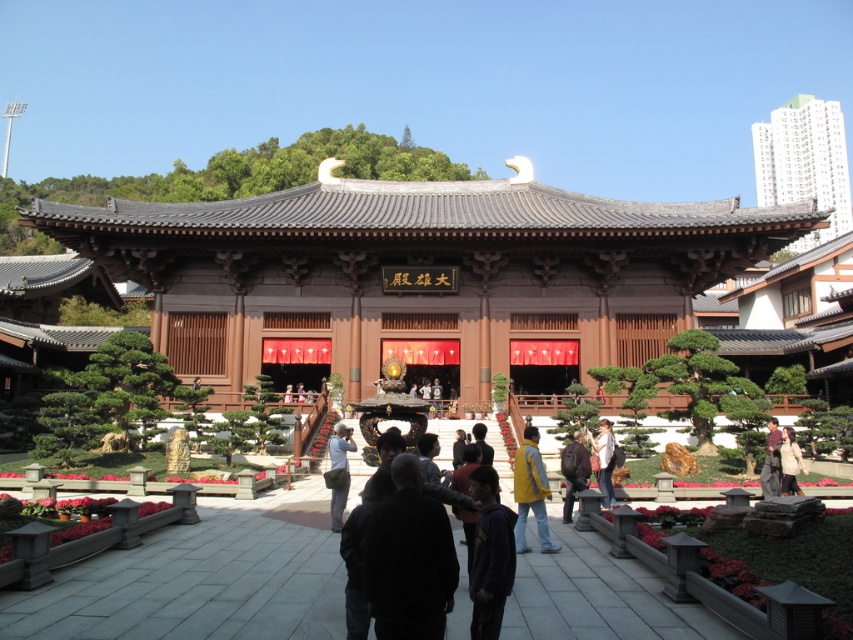
Consider the image. You are a tourist visiting this East Asian temple. You see the white concrete building at upper right and the yellow fabric jacket at center. Which object is bigger in size?

The white concrete building at upper right is larger in size than the yellow fabric jacket at center.

You are a visitor at this temple and see both the brown leather jacket at center and the denim jacket at lower center placed in the courtyard. If you want to pick up the jacket that is closer to the ground, which one should you choose?

The denim jacket at lower center is closer to the ground, so you should choose the denim jacket at lower center.

You are a visitor to this temple and have brought two jackets with you. You need to place them on the stone tiles in the courtyard. The brown leather jacket at center is wider than the denim jacket at lower center. Which jacket should you choose if you want to place the larger one on the tiles first?

The brown leather jacket at center is wider than the denim jacket at lower center, so you should place the brown leather jacket at center first since it is the larger one.